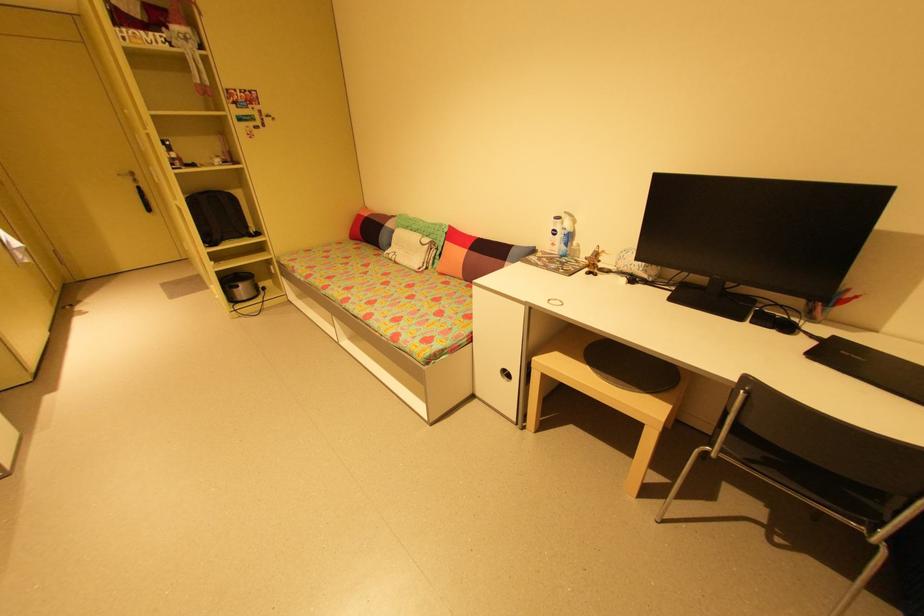
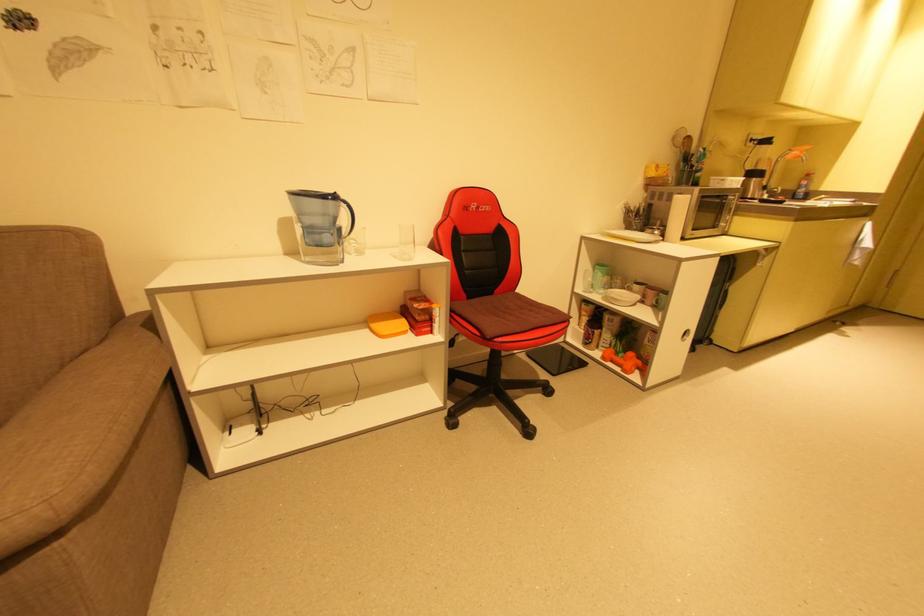
The images are taken continuously from a first-person perspective. In which direction is your viewpoint rotating?

The camera rotated toward left-down.